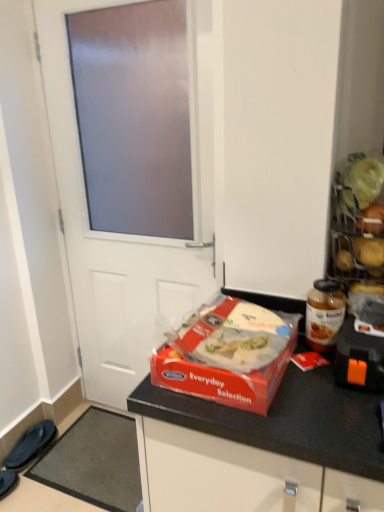
Question: Is white matte door at center to the left or to the right of translucent glass jar at right in the image?

Choices:
 (A) right
 (B) left

Answer: (B)

Question: Looking at the image, does white matte door at center seem bigger or smaller compared to translucent glass jar at right?

Choices:
 (A) big
 (B) small

Answer: (A)

Question: Based on their relative distances, which object is nearer to the white matte door at center?

Choices:
 (A) gray carpet at lower left
 (B) black fabric slipper at lower left, the first footwear when ordered from back to front
 (C) translucent glass jar at right
 (D) dark blue fabric slippers at lower left, the second footwear viewed from the back
 (E) red matte plastic box of food at center

Answer: (A)

Question: Which object is the closest to the red matte plastic box of food at center?

Choices:
 (A) translucent glass jar at right
 (B) black fabric slipper at lower left, the first footwear when ordered from back to front
 (C) dark blue fabric slippers at lower left, the second footwear viewed from the back
 (D) white matte door at center
 (E) gray carpet at lower left

Answer: (A)